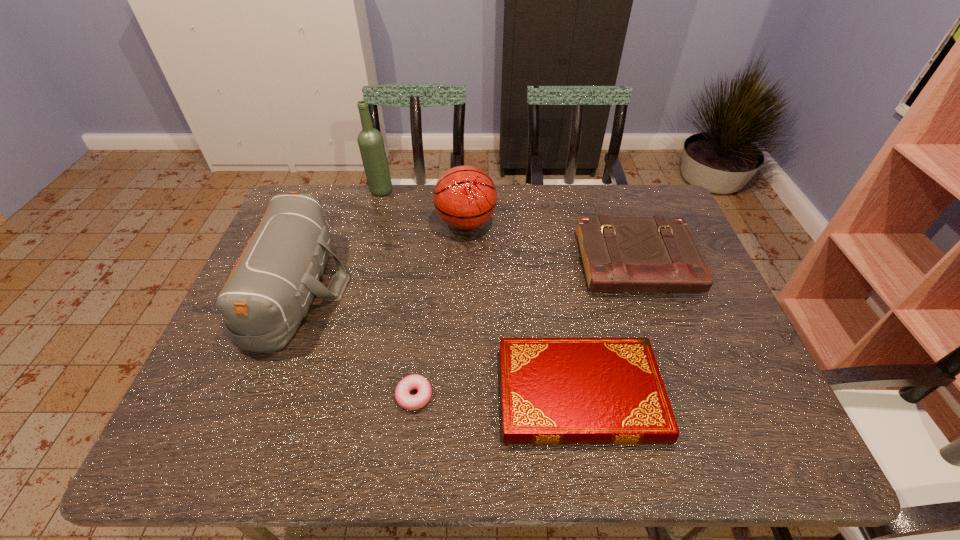
Image resolution: width=960 pixels, height=540 pixels. In order to click on wine bottle in this screenshot , I will do `click(370, 141)`.

What are the coordinates of `the tallest object` in the screenshot? It's located at (370, 141).

Identify the location of basketball. This screenshot has height=540, width=960. (465, 197).

You are a GUI agent. You are given a task and a screenshot of the screen. Output one action in this format:
    pyautogui.click(x=<x>, y=<y>)
    Task: Click on the duffel bag
    
    Given the screenshot: What is the action you would take?
    pyautogui.click(x=269, y=291)

You are a GUI agent. You are given a task and a screenshot of the screen. Output one action in this format:
    pyautogui.click(x=<x>, y=<y>)
    Task: Click on the farther hardback book
    
    Given the screenshot: What is the action you would take?
    pyautogui.click(x=619, y=254)

Identify the location of the taller hardback book. (619, 254).

Find the location of a particular element. This screenshot has width=960, height=540. the nearer hardback book is located at coordinates (553, 390).

Find the location of a particular element. This screenshot has height=540, width=960. the shorter hardback book is located at coordinates (553, 390).

Identify the location of the shortest object. The height and width of the screenshot is (540, 960). (403, 397).

Where is `free point located 0.140m on the right of the wine bottle`? The width and height of the screenshot is (960, 540). free point located 0.140m on the right of the wine bottle is located at coordinates (434, 191).